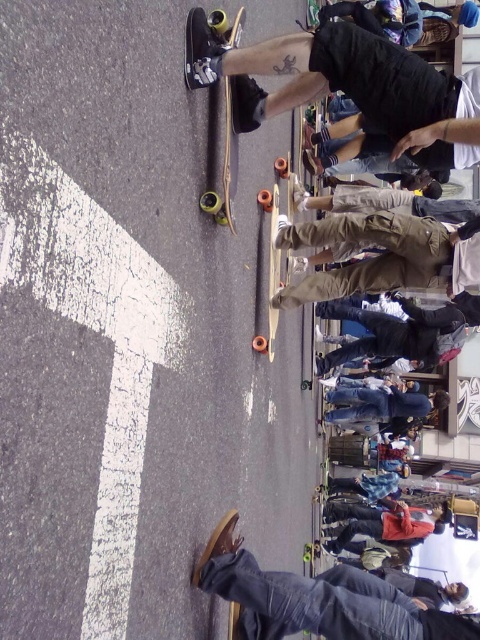
Which is below, wooden smooth skateboard at center or yellow-green rubber skateboard at center?

yellow-green rubber skateboard at center is lower down.

What are the coordinates of `wooden smooth skateboard at center` in the screenshot? It's located at (273, 240).

Identify the location of wooden smooth skateboard at center. (273, 240).

Who is taller, shiny black skateboard at upper center or wooden smooth skateboard at center?

wooden smooth skateboard at center

Does shiny black skateboard at upper center appear over wooden smooth skateboard at center?

Indeed, shiny black skateboard at upper center is positioned over wooden smooth skateboard at center.

Does point (266, 112) come closer to viewer compared to point (287, 172)?

Yes, it is.

Locate an element on the screen. This screenshot has height=640, width=480. shiny black skateboard at upper center is located at coordinates (333, 77).

From the picture: Can you confirm if wooden skateboard at upper center is wider than yellow-green rubber skateboard at center?

In fact, wooden skateboard at upper center might be narrower than yellow-green rubber skateboard at center.

I want to click on wooden skateboard at upper center, so click(x=207, y=38).